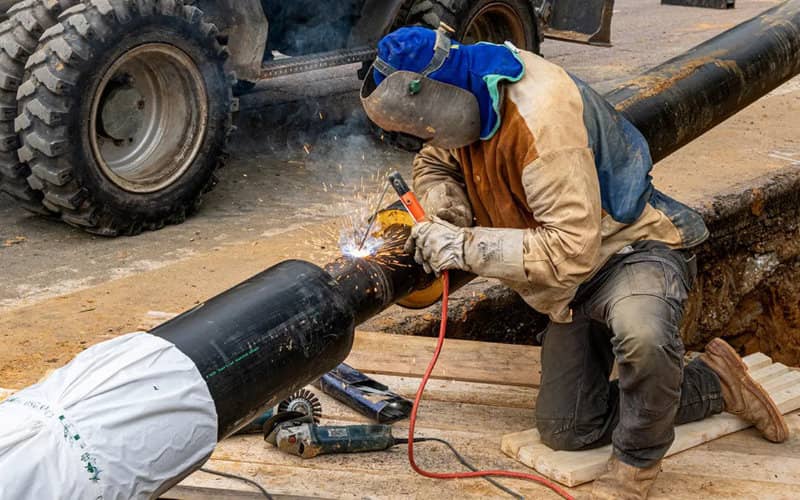
Identify the location of cables. (246, 480), (410, 431), (448, 446).